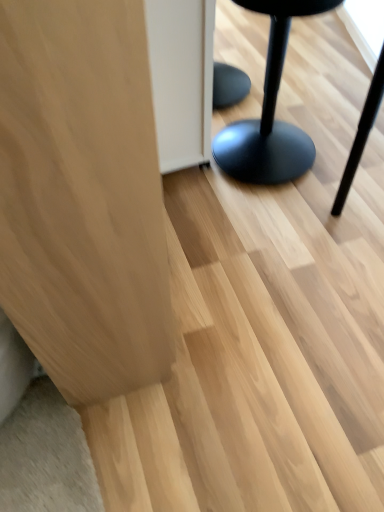
Question: In the image, is light wood cabinet at left, the 1th furniture from the left, positioned in front of or behind matte black stool at right, the 2th furniture when ordered from left to right?

Choices:
 (A) front
 (B) behind

Answer: (A)

Question: Considering the positions of light wood cabinet at left, positioned as the second furniture in right-to-left order, and matte black stool at right, placed as the first furniture when sorted from right to left, in the image, is light wood cabinet at left, positioned as the second furniture in right-to-left order, taller or shorter than matte black stool at right, placed as the first furniture when sorted from right to left,?

Choices:
 (A) tall
 (B) short

Answer: (A)

Question: Is light wood cabinet at left, positioned as the second furniture in right-to-left order, spatially inside matte black stool at right, the 2th furniture when ordered from left to right, or outside of it?

Choices:
 (A) outside
 (B) inside

Answer: (A)

Question: Is point coord(231,145) closer or farther from the camera than point coord(81,336)?

Choices:
 (A) farther
 (B) closer

Answer: (A)

Question: From a real-world perspective, is matte black stool at right, placed as the first furniture when sorted from right to left, physically located above or below light wood cabinet at left, positioned as the second furniture in right-to-left order?

Choices:
 (A) above
 (B) below

Answer: (B)

Question: In the image, is matte black stool at right, placed as the first furniture when sorted from right to left, positioned in front of or behind light wood cabinet at left, positioned as the second furniture in right-to-left order?

Choices:
 (A) front
 (B) behind

Answer: (B)

Question: From the image's perspective, is matte black stool at right, placed as the first furniture when sorted from right to left, above or below light wood cabinet at left, positioned as the second furniture in right-to-left order?

Choices:
 (A) below
 (B) above

Answer: (B)